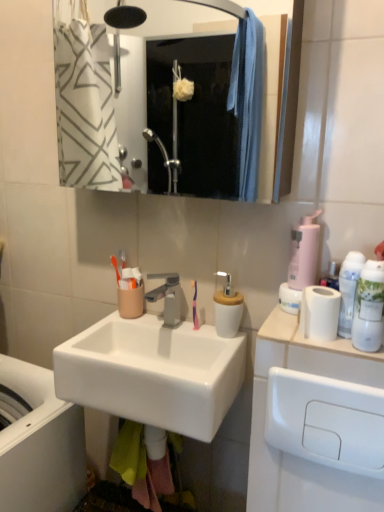
I want to click on free spot to the left of satin nickel faucet at center, so click(x=98, y=330).